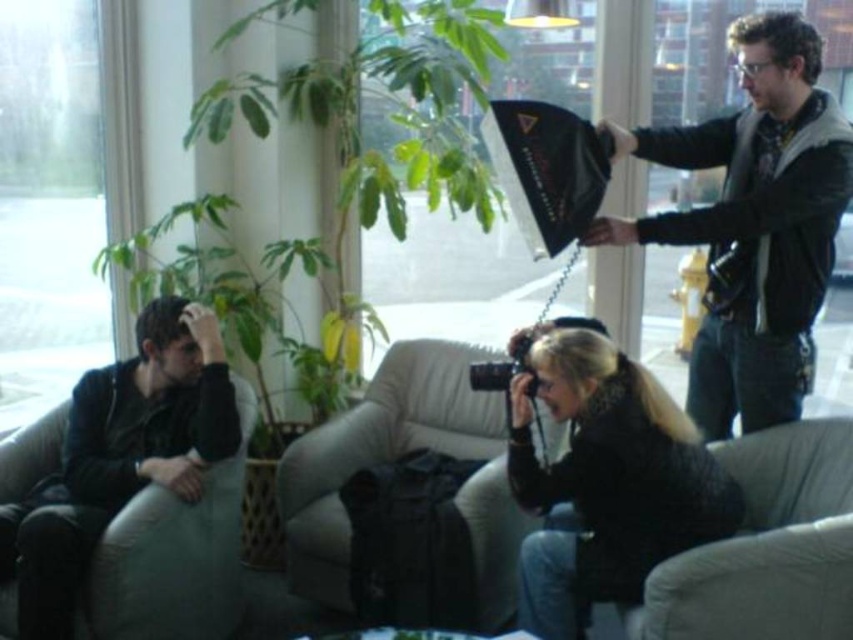
Question: Which of these objects is positioned closest to the black leather jacket at upper right?

Choices:
 (A) black textured camera at lower center
 (B) beige fabric couch at center

Answer: (A)

Question: Where is black textured camera at lower center located in relation to black leather jacket at left in the image?

Choices:
 (A) above
 (B) below

Answer: (B)

Question: Does green leafy plant at center lie behind gray fabric armchair at lower right?

Choices:
 (A) yes
 (B) no

Answer: (A)

Question: Does black leather jacket at upper right appear on the left side of black leather jacket at left?

Choices:
 (A) yes
 (B) no

Answer: (B)

Question: Estimate the real-world distances between objects in this image. Which object is closer to the black leather jacket at upper right?

Choices:
 (A) green leafy plant at center
 (B) black leather jacket at left

Answer: (A)

Question: Which of the following is the farthest from the observer?

Choices:
 (A) (653, 573)
 (B) (693, 544)
 (C) (804, 394)
 (D) (68, 490)

Answer: (D)